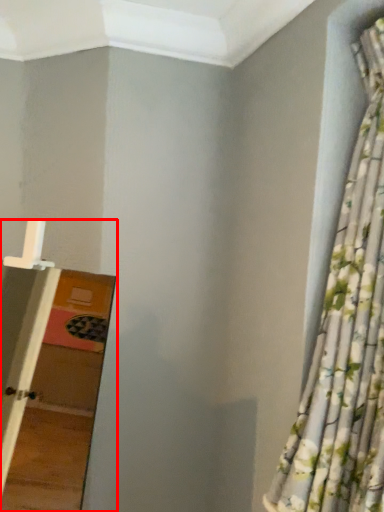
Question: From the image's perspective, where is ladder (annotated by the red box) located relative to curtain?

Choices:
 (A) below
 (B) above

Answer: (A)